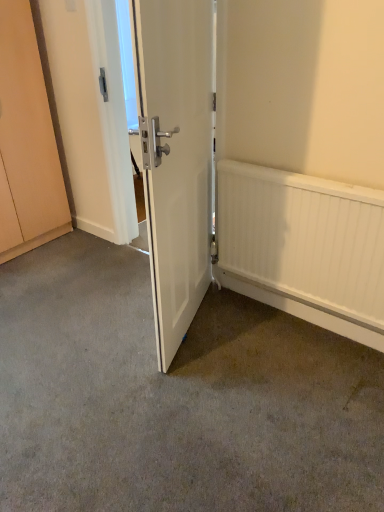
What is the approximate width of white textured radiator at right?

It is 3.39 inches.

Measure the distance between point (339, 264) and camera.

They are 5.94 feet apart.

This screenshot has width=384, height=512. Identify the location of white matte door at center. (175, 156).

Considering the sizes of objects white textured radiator at right and matte wood cabinet at left in the image provided, who is shorter, white textured radiator at right or matte wood cabinet at left?

white textured radiator at right.

I want to click on cabinetry behind the white textured radiator at right, so click(26, 142).

Between point (374, 272) and point (54, 151), which one is positioned behind?

The point (54, 151) is farther from the camera.

From a real-world perspective, who is located higher, white textured radiator at right or matte wood cabinet at left?

matte wood cabinet at left.

Would you say white matte door at center contains white textured radiator at right?

No, white textured radiator at right is not a part of white matte door at center.

Is white matte door at center placed right next to white textured radiator at right?

No, white matte door at center is not touching white textured radiator at right.

Considering the sizes of objects white matte door at center and white textured radiator at right in the image provided, who is bigger, white matte door at center or white textured radiator at right?

Bigger between the two is white matte door at center.

Is white matte door at center looking in the opposite direction of white textured radiator at right?

Yes.

Is white matte door at center a part of gray carpet at center?

No, white matte door at center is located outside of gray carpet at center.

Is gray carpet at center looking in the opposite direction of white matte door at center?

gray carpet at center is not turned away from white matte door at center.

Considering the sizes of gray carpet at center and white matte door at center in the image, is gray carpet at center bigger or smaller than white matte door at center?

Considering their sizes, gray carpet at center takes up more space than white matte door at center.

The image size is (384, 512). I want to click on concrete on the left of white matte door at center, so click(x=175, y=397).

From the image's perspective, is white matte door at center above matte wood cabinet at left?

No, from the image's perspective, white matte door at center is not over matte wood cabinet at left.

Is point (155, 274) closer or farther from the camera than point (32, 142)?

Point (155, 274) appears to be closer to the viewer than point (32, 142).

Would you consider white matte door at center to be distant from matte wood cabinet at left?

Yes, white matte door at center and matte wood cabinet at left are quite far apart.

The image size is (384, 512). I want to click on door on the right of matte wood cabinet at left, so click(x=175, y=156).

Between matte wood cabinet at left and white matte door at center, which one appears on the right side from the viewer's perspective?

Positioned to the right is white matte door at center.

Is matte wood cabinet at left in front of white matte door at center?

No, matte wood cabinet at left is further to the viewer.

Is matte wood cabinet at left directly adjacent to white matte door at center?

They are not placed beside each other.

From the image's perspective, is gray carpet at center above or below matte wood cabinet at left?

gray carpet at center is situated lower than matte wood cabinet at left in the image.

Is point (50, 424) behind point (42, 142)?

That is False.

Between gray carpet at center and matte wood cabinet at left, which one is positioned in front?

gray carpet at center is more forward.

Who is bigger, gray carpet at center or matte wood cabinet at left?

Answer: matte wood cabinet at left is bigger.

Which is more to the right, white textured radiator at right or gray carpet at center?

white textured radiator at right.

Which of these two, white textured radiator at right or gray carpet at center, stands taller?

white textured radiator at right.

Is white textured radiator at right spatially inside gray carpet at center, or outside of it?

white textured radiator at right exists outside the volume of gray carpet at center.

Considering the sizes of objects white textured radiator at right and gray carpet at center in the image provided, who is smaller, white textured radiator at right or gray carpet at center?

white textured radiator at right is smaller.

At what (x,y) coordinates should I click in order to perform the action: click on radiator that appears on the right of matte wood cabinet at left. Please return your answer as a coordinate pair (x, y). The height and width of the screenshot is (512, 384). Looking at the image, I should click on (304, 239).

Find the location of `door lying in front of the white textured radiator at right`. door lying in front of the white textured radiator at right is located at coordinates (175, 156).

Based on their spatial positions, is matte wood cabinet at left or white textured radiator at right further from white matte door at center?

matte wood cabinet at left is positioned further to the anchor white matte door at center.

Looking at the image, which one is located closer to gray carpet at center, white matte door at center or matte wood cabinet at left?

white matte door at center lies closer to gray carpet at center than the other object.

Which object lies further to the anchor point white textured radiator at right, matte wood cabinet at left or white matte door at center?

Among the two, matte wood cabinet at left is located further to white textured radiator at right.

Looking at the image, which one is located further to matte wood cabinet at left, gray carpet at center or white textured radiator at right?

Among the two, white textured radiator at right is located further to matte wood cabinet at left.

Looking at the image, which one is located further to gray carpet at center, matte wood cabinet at left or white textured radiator at right?

The object further to gray carpet at center is matte wood cabinet at left.

When comparing their distances from white matte door at center, does matte wood cabinet at left or gray carpet at center seem further?

matte wood cabinet at left is positioned further to the anchor white matte door at center.

Considering their positions, is white textured radiator at right positioned further to matte wood cabinet at left than white matte door at center?

white textured radiator at right is further to matte wood cabinet at left.

Which object lies nearer to the anchor point white matte door at center, gray carpet at center or matte wood cabinet at left?

gray carpet at center lies closer to white matte door at center than the other object.

In order to click on door between gray carpet at center and white textured radiator at right in this screenshot , I will do 175,156.

Locate an element on the screen. This screenshot has width=384, height=512. concrete between matte wood cabinet at left and white matte door at center is located at coordinates (175, 397).

Find the location of a particular element. concrete between matte wood cabinet at left and white textured radiator at right is located at coordinates (175, 397).

Locate an element on the screen. This screenshot has width=384, height=512. door between matte wood cabinet at left and white textured radiator at right is located at coordinates (175, 156).